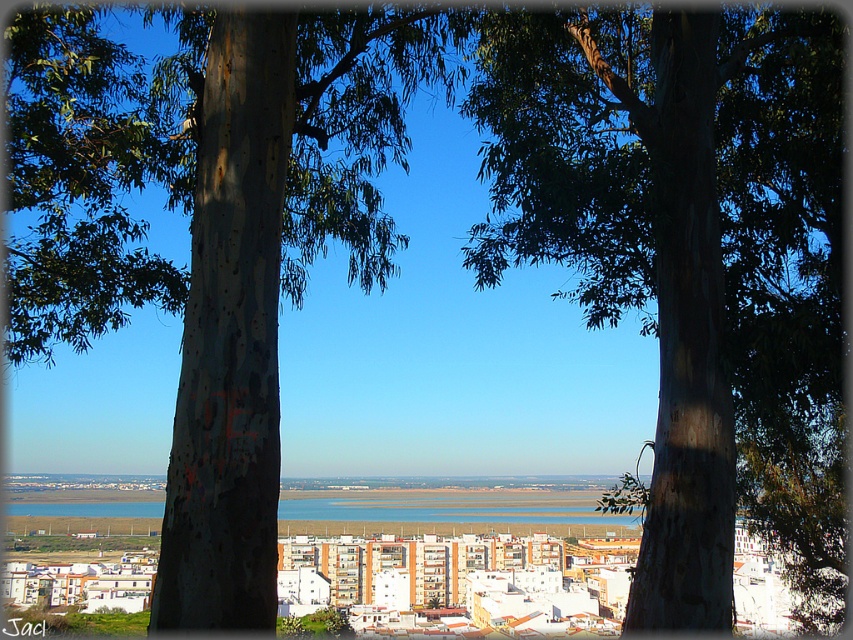
Can you confirm if smooth bark tree at center is taller than blue water at center?

Answer: Yes.

Does smooth bark tree at center appear over blue water at center?

Indeed, smooth bark tree at center is positioned over blue water at center.

The width and height of the screenshot is (853, 640). I want to click on smooth bark tree at center, so click(x=207, y=230).

Is the position of brown rough bark tree at center less distant than that of smooth bark tree at center?

No.

The height and width of the screenshot is (640, 853). I want to click on brown rough bark tree at center, so click(688, 253).

You are a GUI agent. You are given a task and a screenshot of the screen. Output one action in this format:
    pyautogui.click(x=<x>, y=<y>)
    Task: Click on the brown rough bark tree at center
    The height and width of the screenshot is (640, 853).
    Given the screenshot: What is the action you would take?
    pyautogui.click(x=688, y=253)

In order to click on brown rough bark tree at center in this screenshot , I will do `click(688, 253)`.

Looking at this image, is brown rough bark tree at center closer to camera compared to blue water at center?

Yes.

Does brown rough bark tree at center appear on the right side of blue water at center?

Indeed, brown rough bark tree at center is positioned on the right side of blue water at center.

The width and height of the screenshot is (853, 640). What do you see at coordinates (688, 253) in the screenshot?
I see `brown rough bark tree at center` at bounding box center [688, 253].

The image size is (853, 640). I want to click on brown rough bark tree at center, so click(x=688, y=253).